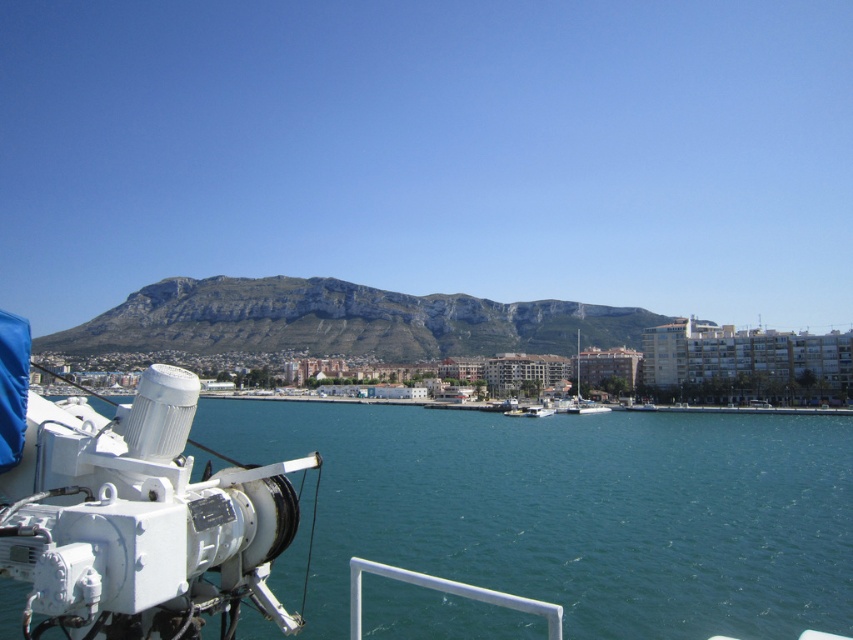
At what (x,y) coordinates should I click in order to perform the action: click on clear blue water at lower left. Please return your answer as a coordinate pair (x, y). Image resolution: width=853 pixels, height=640 pixels. Looking at the image, I should click on (576, 509).

Image resolution: width=853 pixels, height=640 pixels. Identify the location of rugged stone mountain at center. (340, 321).

Is point (102, 320) farther from viewer compared to point (592, 404)?

Yes, point (102, 320) is farther from viewer.

Find the location of a particular element. The height and width of the screenshot is (640, 853). rugged stone mountain at center is located at coordinates (340, 321).

Can you confirm if clear blue water at lower left is shorter than white matte sailboat at center?

No.

Is clear blue water at lower left to the left of white matte sailboat at center from the viewer's perspective?

Indeed, clear blue water at lower left is positioned on the left side of white matte sailboat at center.

Describe the element at coordinates (576, 509) in the screenshot. I see `clear blue water at lower left` at that location.

At what (x,y) coordinates should I click in order to perform the action: click on clear blue water at lower left. Please return your answer as a coordinate pair (x, y). The image size is (853, 640). Looking at the image, I should click on (576, 509).